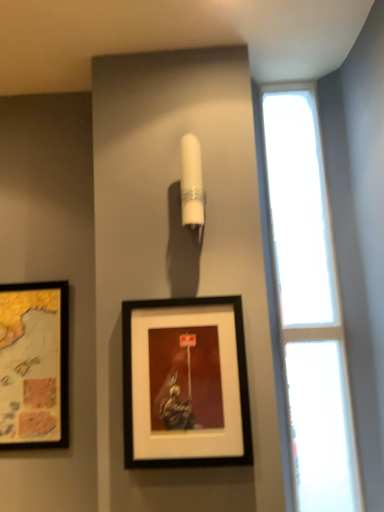
The height and width of the screenshot is (512, 384). What do you see at coordinates (185, 383) in the screenshot?
I see `black matte picture frame at center, acting as the 1th picture frame starting from the front` at bounding box center [185, 383].

Describe the element at coordinates (305, 306) in the screenshot. Image resolution: width=384 pixels, height=512 pixels. I see `transparent glass window at right` at that location.

Where is `black matte picture frame at center, which appears as the second picture frame when viewed from the back`? The width and height of the screenshot is (384, 512). black matte picture frame at center, which appears as the second picture frame when viewed from the back is located at coordinates (185, 383).

Does point (47, 346) come closer to viewer compared to point (333, 255)?

Yes, it is.

Which of these two, matte black picture frame at left, positioned as the second picture frame in front-to-back order, or transparent glass window at right, stands taller?

Standing taller between the two is transparent glass window at right.

From the image's perspective, is matte black picture frame at left, acting as the first picture frame starting from the back, above or below transparent glass window at right?

matte black picture frame at left, acting as the first picture frame starting from the back, is situated lower than transparent glass window at right in the image.

Does matte black picture frame at left, which is counted as the 1th picture frame, starting from the left, contain transparent glass window at right?

Definitely not — transparent glass window at right is not inside matte black picture frame at left, which is counted as the 1th picture frame, starting from the left.

Is point (300, 472) in front of point (21, 407)?

Yes, it is in front of point (21, 407).

From a real-world perspective, is transparent glass window at right physically located above or below matte black picture frame at left, which is counted as the 1th picture frame, starting from the left?

Clearly, from a real-world perspective, transparent glass window at right is above matte black picture frame at left, which is counted as the 1th picture frame, starting from the left.

Does black matte picture frame at center, the 2th picture frame viewed from the left, come behind matte black picture frame at left, positioned as the second picture frame in front-to-back order?

No, the depth of black matte picture frame at center, the 2th picture frame viewed from the left, is less than that of matte black picture frame at left, positioned as the second picture frame in front-to-back order.

Is black matte picture frame at center, acting as the 1th picture frame starting from the front, positioned with its back to matte black picture frame at left, which is counted as the 1th picture frame, starting from the left?

No, black matte picture frame at center, acting as the 1th picture frame starting from the front, is not facing the opposite direction of matte black picture frame at left, which is counted as the 1th picture frame, starting from the left.

Considering the relative positions of black matte picture frame at center, the 2th picture frame viewed from the left, and matte black picture frame at left, acting as the first picture frame starting from the back, in the image provided, is black matte picture frame at center, the 2th picture frame viewed from the left, to the left or to the right of matte black picture frame at left, acting as the first picture frame starting from the back,?

Clearly, black matte picture frame at center, the 2th picture frame viewed from the left, is on the right of matte black picture frame at left, acting as the first picture frame starting from the back, in the image.

Is matte black picture frame at left, which is the second picture frame from right to left, surrounding black matte picture frame at center, the 2th picture frame viewed from the left?

No, matte black picture frame at left, which is the second picture frame from right to left, does not contain black matte picture frame at center, the 2th picture frame viewed from the left.

Is matte black picture frame at left, positioned as the second picture frame in front-to-back order, wider or thinner than black matte picture frame at center, which appears as the second picture frame when viewed from the back?

matte black picture frame at left, positioned as the second picture frame in front-to-back order, is thinner than black matte picture frame at center, which appears as the second picture frame when viewed from the back.

Is black matte picture frame at center, the 2th picture frame viewed from the left, at the back of matte black picture frame at left, which is counted as the 1th picture frame, starting from the left?

matte black picture frame at left, which is counted as the 1th picture frame, starting from the left, does not have its back to black matte picture frame at center, the 2th picture frame viewed from the left.

Is point (59, 359) less distant than point (133, 442)?

No, (59, 359) is further to viewer.

Does transparent glass window at right turn towards black matte picture frame at center, which appears as the second picture frame when viewed from the back?

No.

Where is `the 1st picture frame to the left of the transparent glass window at right, starting your count from the anchor`? the 1st picture frame to the left of the transparent glass window at right, starting your count from the anchor is located at coordinates (185, 383).

Between black matte picture frame at center, the 2th picture frame viewed from the left, and transparent glass window at right, which one appears on the left side from the viewer's perspective?

black matte picture frame at center, the 2th picture frame viewed from the left.

Can you confirm if black matte picture frame at center, which appears as the second picture frame when viewed from the back, is taller than transparent glass window at right?

No, black matte picture frame at center, which appears as the second picture frame when viewed from the back, is not taller than transparent glass window at right.

From a real-world perspective, is black matte picture frame at center, which appears as the second picture frame when viewed from the back, positioned above or below transparent glass window at right?

black matte picture frame at center, which appears as the second picture frame when viewed from the back, is situated lower than transparent glass window at right in the real world.

Which object is more forward, black matte picture frame at center, the 1th picture frame when ordered from right to left, or transparent glass window at right?

black matte picture frame at center, the 1th picture frame when ordered from right to left, is more forward.

At what (x,y) coordinates should I click in order to perform the action: click on window lying on the right of matte black picture frame at left, which is counted as the 1th picture frame, starting from the left. Please return your answer as a coordinate pair (x, y). The height and width of the screenshot is (512, 384). Looking at the image, I should click on (305, 306).

The width and height of the screenshot is (384, 512). Identify the location of picture frame that is the 2nd one when counting downward from the transparent glass window at right (from the image's perspective). (34, 365).

Considering their positions, is matte black picture frame at left, positioned as the second picture frame in front-to-back order, positioned further to black matte picture frame at center, which appears as the second picture frame when viewed from the back, than transparent glass window at right?

matte black picture frame at left, positioned as the second picture frame in front-to-back order, lies further to black matte picture frame at center, which appears as the second picture frame when viewed from the back, than the other object.

Considering their positions, is matte black picture frame at left, which is counted as the 1th picture frame, starting from the left, positioned further to transparent glass window at right than black matte picture frame at center, the 2th picture frame viewed from the left?

matte black picture frame at left, which is counted as the 1th picture frame, starting from the left, lies further to transparent glass window at right than the other object.

When comparing their distances from matte black picture frame at left, positioned as the second picture frame in front-to-back order, does black matte picture frame at center, the 1th picture frame when ordered from right to left, or transparent glass window at right seem closer?

black matte picture frame at center, the 1th picture frame when ordered from right to left, is positioned closer to the anchor matte black picture frame at left, positioned as the second picture frame in front-to-back order.

Estimate the real-world distances between objects in this image. Which object is closer to transparent glass window at right, black matte picture frame at center, which appears as the second picture frame when viewed from the back, or matte black picture frame at left, positioned as the second picture frame in front-to-back order?

Among the two, black matte picture frame at center, which appears as the second picture frame when viewed from the back, is located nearer to transparent glass window at right.

Based on their spatial positions, is transparent glass window at right or matte black picture frame at left, which is the second picture frame from right to left, closer to black matte picture frame at center, acting as the 1th picture frame starting from the front?

transparent glass window at right lies closer to black matte picture frame at center, acting as the 1th picture frame starting from the front, than the other object.

Which object lies further to the anchor point matte black picture frame at left, acting as the first picture frame starting from the back, transparent glass window at right or black matte picture frame at center, the 1th picture frame when ordered from right to left?

transparent glass window at right lies further to matte black picture frame at left, acting as the first picture frame starting from the back, than the other object.

Where is `picture frame located between matte black picture frame at left, acting as the first picture frame starting from the back, and transparent glass window at right in the left-right direction`? The image size is (384, 512). picture frame located between matte black picture frame at left, acting as the first picture frame starting from the back, and transparent glass window at right in the left-right direction is located at coordinates (185, 383).